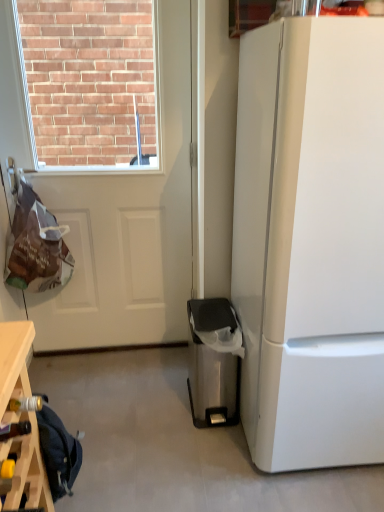
Question: Can you confirm if stainless steel trash can at lower right is shorter than white glossy refrigerator at right?

Choices:
 (A) yes
 (B) no

Answer: (A)

Question: Does stainless steel trash can at lower right have a lesser width compared to white glossy refrigerator at right?

Choices:
 (A) no
 (B) yes

Answer: (B)

Question: Considering the relative positions of stainless steel trash can at lower right and white glossy refrigerator at right in the image provided, is stainless steel trash can at lower right to the right of white glossy refrigerator at right from the viewer's perspective?

Choices:
 (A) no
 (B) yes

Answer: (A)

Question: Does stainless steel trash can at lower right touch white glossy refrigerator at right?

Choices:
 (A) no
 (B) yes

Answer: (A)

Question: Is white glossy refrigerator at right at the back of stainless steel trash can at lower right?

Choices:
 (A) yes
 (B) no

Answer: (B)

Question: Visually, is wooden wine rack at lower left positioned to the left or to the right of white matte door at upper left?

Choices:
 (A) right
 (B) left

Answer: (B)

Question: From a real-world perspective, is wooden wine rack at lower left above or below white matte door at upper left?

Choices:
 (A) above
 (B) below

Answer: (B)

Question: From their relative heights in the image, would you say wooden wine rack at lower left is taller or shorter than white matte door at upper left?

Choices:
 (A) short
 (B) tall

Answer: (A)

Question: Considering the positions of point (36, 501) and point (142, 181), is point (36, 501) closer or farther from the camera than point (142, 181)?

Choices:
 (A) closer
 (B) farther

Answer: (A)

Question: From a real-world perspective, relative to stainless steel trash can at lower right, is wooden wine rack at lower left vertically above or below?

Choices:
 (A) above
 (B) below

Answer: (A)

Question: Is wooden wine rack at lower left in front of or behind stainless steel trash can at lower right in the image?

Choices:
 (A) behind
 (B) front

Answer: (B)

Question: Based on their positions, is wooden wine rack at lower left located to the left or right of stainless steel trash can at lower right?

Choices:
 (A) right
 (B) left

Answer: (B)

Question: Is wooden wine rack at lower left bigger or smaller than stainless steel trash can at lower right?

Choices:
 (A) big
 (B) small

Answer: (B)

Question: Relative to white glossy refrigerator at right, is wooden wine rack at lower left in front or behind?

Choices:
 (A) front
 (B) behind

Answer: (B)

Question: In terms of height, does wooden wine rack at lower left look taller or shorter compared to white glossy refrigerator at right?

Choices:
 (A) short
 (B) tall

Answer: (A)